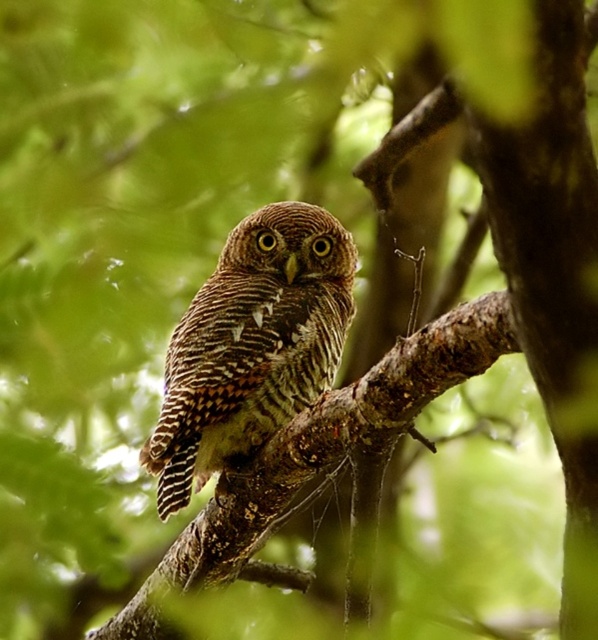
Where is `brown speckled owl at center`? brown speckled owl at center is located at coordinates (251, 344).

At what (x,y) coordinates should I click in order to perform the action: click on brown speckled owl at center. Please return your answer as a coordinate pair (x, y). This screenshot has width=598, height=640. Looking at the image, I should click on (251, 344).